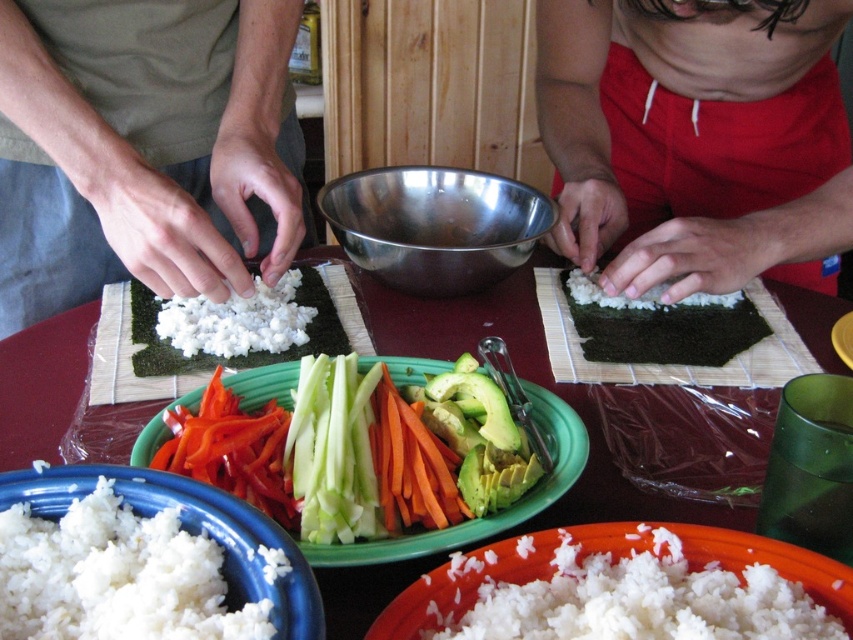
You are a chef preparing sushi and need to place the white fluffy rice at center onto the marble table at center. Based on the scene description, which object is located to the left of the other?

The white fluffy rice at center is to the left of the marble table at center because the marble table at center is positioned on the right side of the white fluffy rice at center.

What are the coordinates of the marble table at center?

The marble table at center is located at coordinates point (524,378).

You are a sushi chef preparing a roll and need to grab both the orange sliced carrot at center and the white fluffy rice at center. Can you reach both items without moving your hands? Assume your hands can cover an area of 15 centimeters.

The orange sliced carrot at center and the white fluffy rice at center are 18.78 centimeters apart from each other. Since your hands can only cover 15 centimeters, you cannot reach both items without moving your hands.